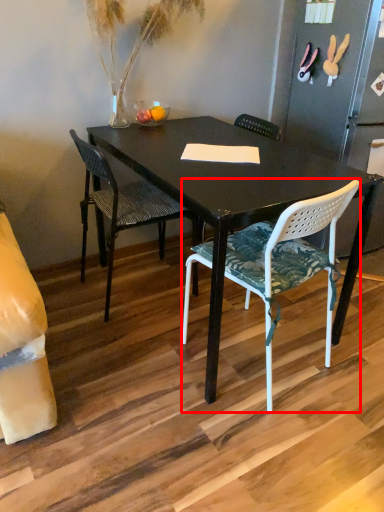
Question: From the image's perspective, where is chair (annotated by the red box) located relative to chair?

Choices:
 (A) above
 (B) below

Answer: (B)